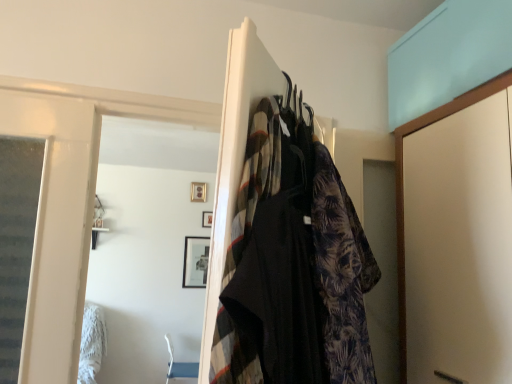
The image size is (512, 384). What are the coordinates of `printed fabric robe at center` in the screenshot? It's located at (341, 275).

Describe the element at coordinates (341, 275) in the screenshot. I see `printed fabric robe at center` at that location.

What is the approximate width of printed fabric robe at center?

It is 4.30 inches.

At what (x,y) coordinates should I click in order to perform the action: click on printed fabric dress at center. Please return your answer as a coordinate pair (x, y). Looking at the image, I should click on (293, 264).

Describe the element at coordinates (293, 264) in the screenshot. I see `printed fabric dress at center` at that location.

Find the location of `printed fabric robe at center`. printed fabric robe at center is located at coordinates (341, 275).

Is printed fabric dress at center at the left side of printed fabric robe at center?

Yes.

Considering the positions of objects printed fabric dress at center and printed fabric robe at center in the image provided, who is behind, printed fabric dress at center or printed fabric robe at center?

printed fabric robe at center is behind.

Which point is more distant from viewer, (313, 352) or (316, 251)?

The point (316, 251) is more distant.

From the image's perspective, between printed fabric dress at center and printed fabric robe at center, who is located below?

printed fabric robe at center, from the image's perspective.

From a real-world perspective, which is physically below, printed fabric dress at center or printed fabric robe at center?

From a 3D spatial view, printed fabric robe at center is below.

Considering the sizes of objects printed fabric dress at center and printed fabric robe at center in the image provided, who is wider, printed fabric dress at center or printed fabric robe at center?

Wider between the two is printed fabric dress at center.

Is printed fabric dress at center taller than printed fabric robe at center?

No, printed fabric dress at center is not taller than printed fabric robe at center.

Is printed fabric dress at center bigger than printed fabric robe at center?

Yes.

In the scene shown: Is printed fabric dress at center inside the boundaries of printed fabric robe at center, or outside?

printed fabric dress at center lies outside printed fabric robe at center.

Would you say printed fabric dress at center is a long distance from printed fabric robe at center?

That's not correct — printed fabric dress at center is a little close to printed fabric robe at center.

Is printed fabric dress at center facing towards printed fabric robe at center?

No, printed fabric dress at center is not aimed at printed fabric robe at center.

The image size is (512, 384). I want to click on fancy dress on the left side of printed fabric robe at center, so click(x=293, y=264).

From the picture: Would you say printed fabric robe at center is to the left or to the right of printed fabric dress at center in the picture?

Clearly, printed fabric robe at center is on the right of printed fabric dress at center in the image.

Which object is closer to the camera taking this photo, printed fabric robe at center or printed fabric dress at center?

printed fabric dress at center is in front.

Considering the positions of point (355, 321) and point (264, 119), is point (355, 321) closer or farther from the camera than point (264, 119)?

Point (355, 321) appears to be farther away from the viewer than point (264, 119).

From the image's perspective, is printed fabric robe at center above printed fabric dress at center?

No, from the image's perspective, printed fabric robe at center is not on top of printed fabric dress at center.

From a real-world perspective, is printed fabric robe at center physically below printed fabric dress at center?

Correct, in the physical world, printed fabric robe at center is lower than printed fabric dress at center.

Considering the sizes of objects printed fabric robe at center and printed fabric dress at center in the image provided, who is thinner, printed fabric robe at center or printed fabric dress at center?

With smaller width is printed fabric robe at center.

Does printed fabric robe at center have a greater height compared to printed fabric dress at center?

Yes.

Can you confirm if printed fabric robe at center is smaller than printed fabric dress at center?

Yes, printed fabric robe at center is smaller than printed fabric dress at center.

Is printed fabric robe at center surrounding printed fabric dress at center?

No, printed fabric dress at center is located outside of printed fabric robe at center.

Is printed fabric robe at center placed right next to printed fabric dress at center?

Yes, printed fabric robe at center is right next to printed fabric dress at center and making contact.

Is printed fabric robe at center facing towards printed fabric dress at center?

Yes, printed fabric robe at center is facing printed fabric dress at center.

Locate an element on the screen. clothing on the right of printed fabric dress at center is located at coordinates (341, 275).

Find the location of a particular element. clothing behind the printed fabric dress at center is located at coordinates (341, 275).

Locate an element on the screen. This screenshot has height=384, width=512. fancy dress that is in front of the printed fabric robe at center is located at coordinates point(293,264).